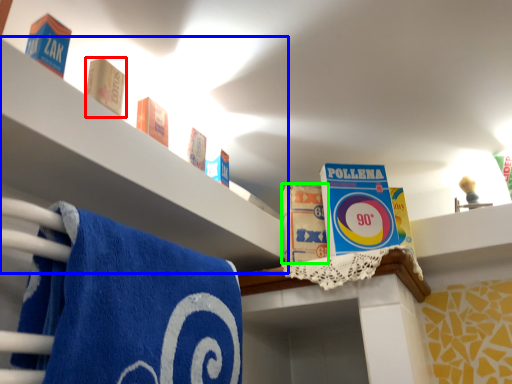
Question: Estimate the real-world distances between objects in this image. Which object is closer to product (highlighted by a red box), shelf (highlighted by a blue box) or product (highlighted by a green box)?

Choices:
 (A) shelf
 (B) product

Answer: (A)